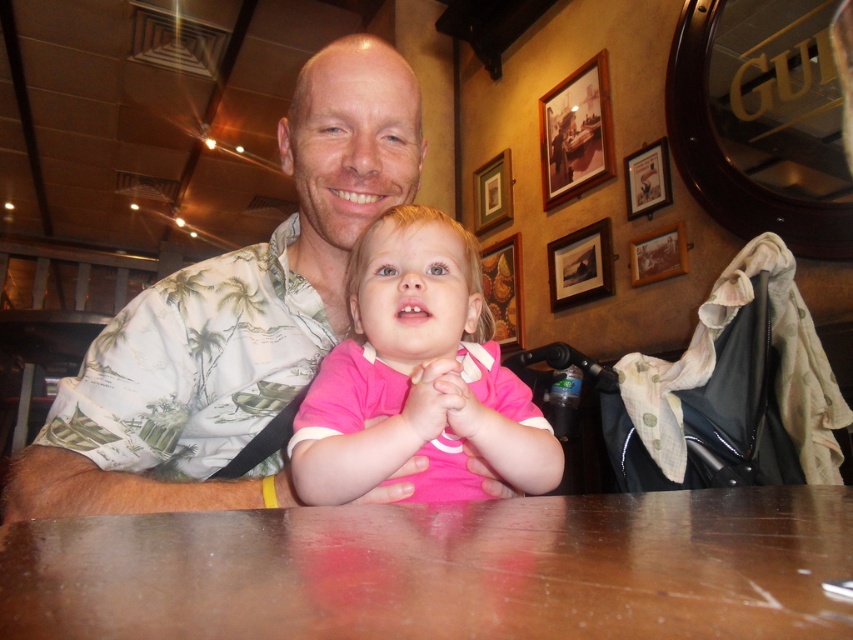
The width and height of the screenshot is (853, 640). Identify the location of wooden table at center. (444, 570).

How far apart are wooden table at center and pink matte shirt at center?

wooden table at center and pink matte shirt at center are 8.25 inches apart from each other.

Identify the location of wooden table at center. (444, 570).

How much distance is there between printed palm tree shirt at center and wooden picture frame at upper center?

They are 1.84 meters apart.

Does point (138, 314) come in front of point (550, 256)?

Yes, point (138, 314) is closer to viewer.

Locate an element on the screen. printed palm tree shirt at center is located at coordinates point(233,316).

Identify the location of printed palm tree shirt at center. The width and height of the screenshot is (853, 640). (233, 316).

Which is more to the right, pink matte shirt at center or wooden picture frame at upper center?

wooden picture frame at upper center

You are a GUI agent. You are given a task and a screenshot of the screen. Output one action in this format:
    pyautogui.click(x=<x>, y=<y>)
    Task: Click on the pink matte shirt at center
    This screenshot has height=640, width=853.
    Given the screenshot: What is the action you would take?
    pyautogui.click(x=416, y=376)

The image size is (853, 640). In order to click on pink matte shirt at center in this screenshot , I will do `click(416, 376)`.

Image resolution: width=853 pixels, height=640 pixels. In order to click on pink matte shirt at center in this screenshot , I will do `click(416, 376)`.